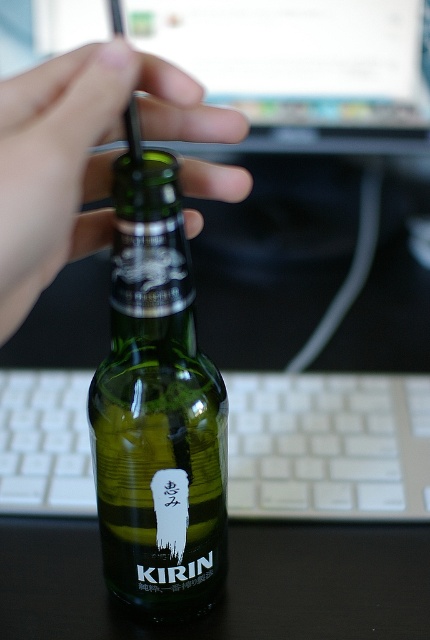
Question: Considering the relative positions of white plastic keyboard at lower center and green matte bottle cap at center in the image provided, where is white plastic keyboard at lower center located with respect to green matte bottle cap at center?

Choices:
 (A) below
 (B) above

Answer: (A)

Question: Which point is farther to the camera?

Choices:
 (A) (106, 93)
 (B) (150, 236)
 (C) (89, 376)

Answer: (C)

Question: Which object is the farthest from the green matte bottle cap at center?

Choices:
 (A) white plastic keyboard at lower center
 (B) green glass bottle at center

Answer: (A)

Question: Is green glass bottle at center wider than green matte bottle cap at center?

Choices:
 (A) yes
 (B) no

Answer: (B)

Question: Among these objects, which one is nearest to the camera?

Choices:
 (A) green matte bottle cap at center
 (B) green glass bottle at center

Answer: (A)

Question: Can you confirm if green glass bottle at center is positioned to the left of green matte bottle cap at center?

Choices:
 (A) no
 (B) yes

Answer: (A)